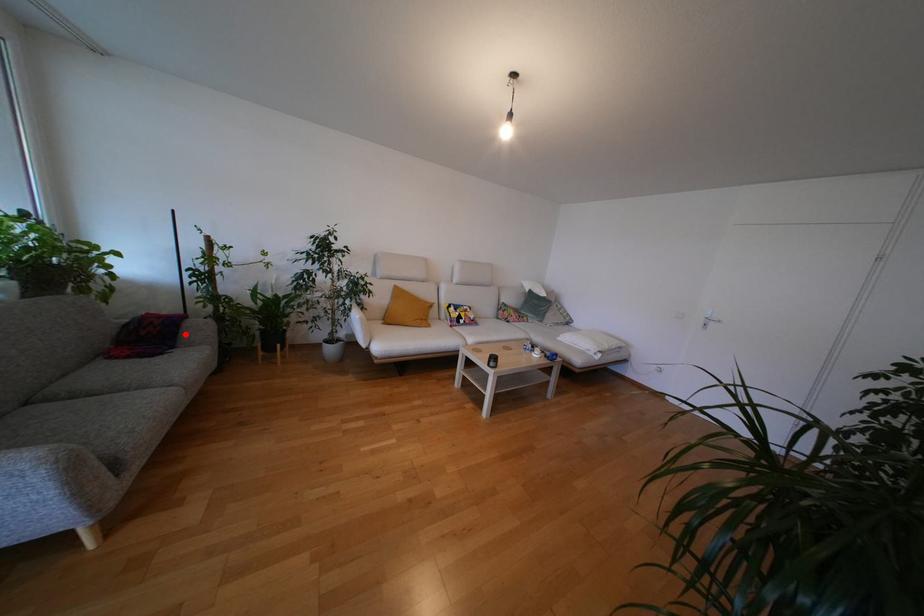
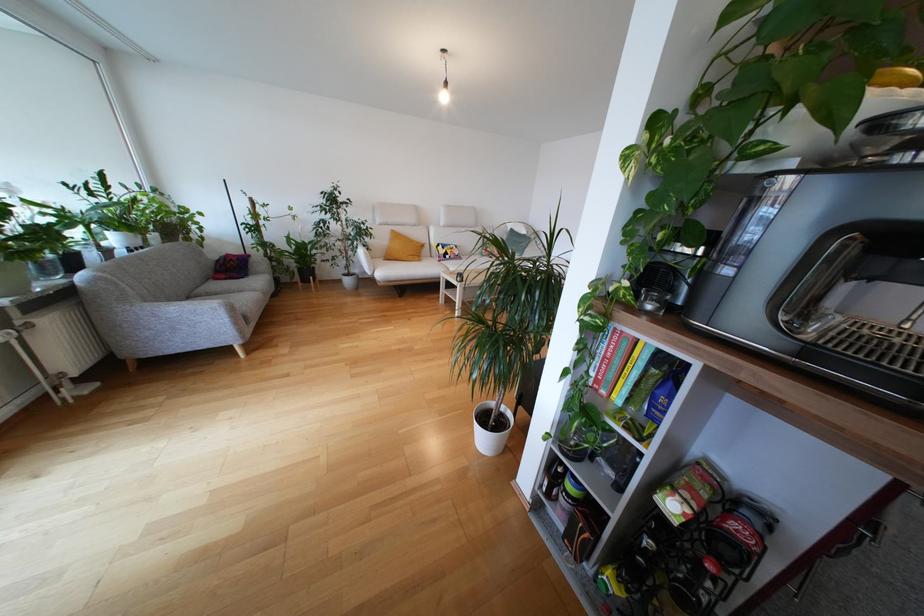
In the second image, find the point that corresponds to the highlighted location in the first image.

(253, 268)